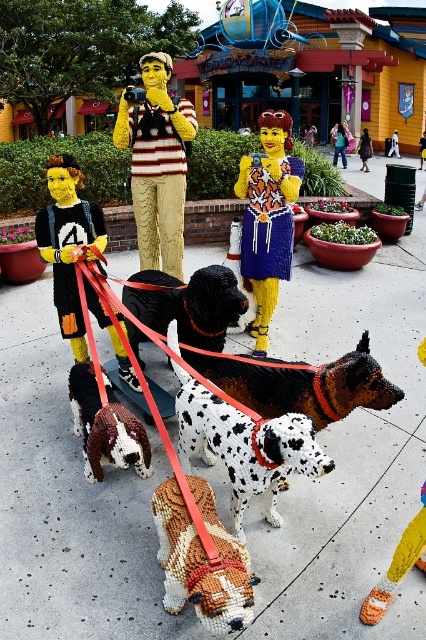
Can you confirm if white speckled plastic dog at center is bigger than black glossy dog at center?

Yes.

Who is lower down, white speckled plastic dog at center or black glossy dog at center?

Positioned lower is white speckled plastic dog at center.

Between point (262, 444) and point (210, 317), which one is positioned behind?

Positioned behind is point (210, 317).

This screenshot has height=640, width=426. I want to click on white speckled plastic dog at center, so click(x=244, y=445).

Is smooth yellow hair at center further to camera compared to matte yellow hair at center?

Yes.

Who is taller, smooth yellow hair at center or matte yellow hair at center?

smooth yellow hair at center

Is point (333, 152) in front of point (362, 156)?

No, (333, 152) is further to viewer.

Identify the location of smooth yellow hair at center. This screenshot has width=426, height=640. (339, 145).

Is point (146, 102) positioned in front of point (279, 378)?

No, (146, 102) is behind (279, 378).

Can you confirm if yellow painted figure at center is shorter than brown speckled fur dog at center?

No.

Is point (144, 68) positioned behind point (238, 380)?

Yes, point (144, 68) is farther from viewer.

The height and width of the screenshot is (640, 426). Identify the location of yellow painted figure at center. (158, 164).